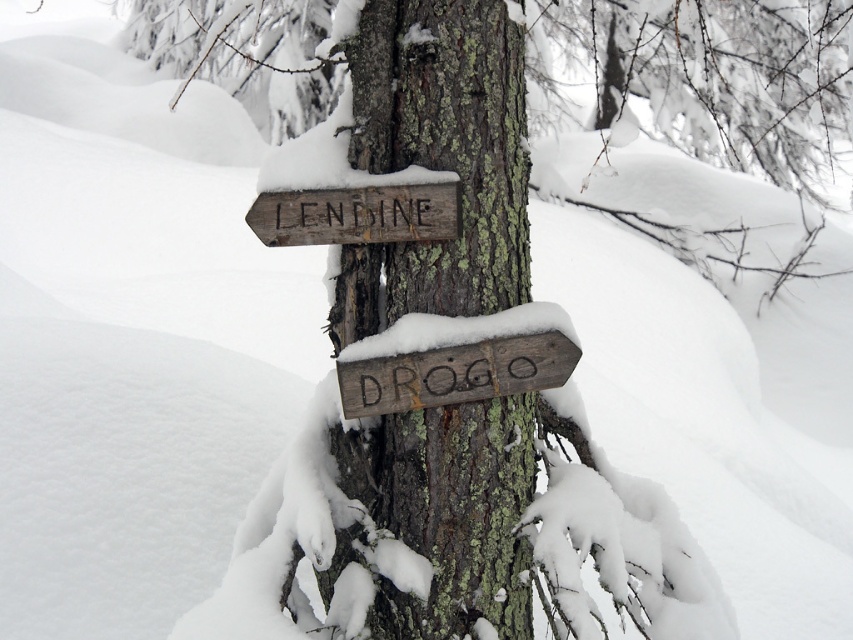
You are a hiker who just arrived at this snowy area and noticed two weathered wood signs attached to the tree trunk. Which of the two signs, the weathered wood sign at center or the weathered wood sign at upper center, is positioned higher on the tree trunk?

The weathered wood sign at upper center is positioned higher on the tree trunk than the weathered wood sign at center.

You are standing in a snowy forest and want to reach a specific point marked as point (531,454). If your average walking pace is 3 feet per second, how many seconds will it take you to reach that point?

The distance between point (531,454) and the viewer is 7.71 feet. At a pace of 3 feet per second, it would take approximately 2.57 seconds to reach the point.